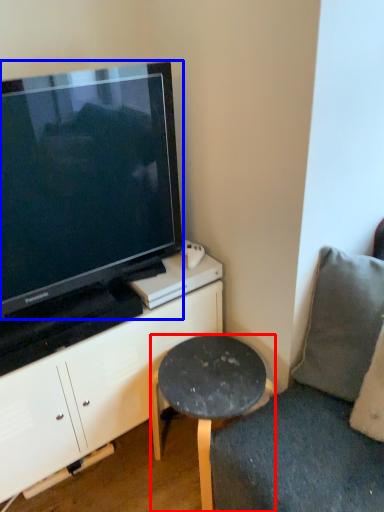
Question: Which of the following is the farthest to the observer, stool (highlighted by a red box) or television (highlighted by a blue box)?

Choices:
 (A) stool
 (B) television

Answer: (A)